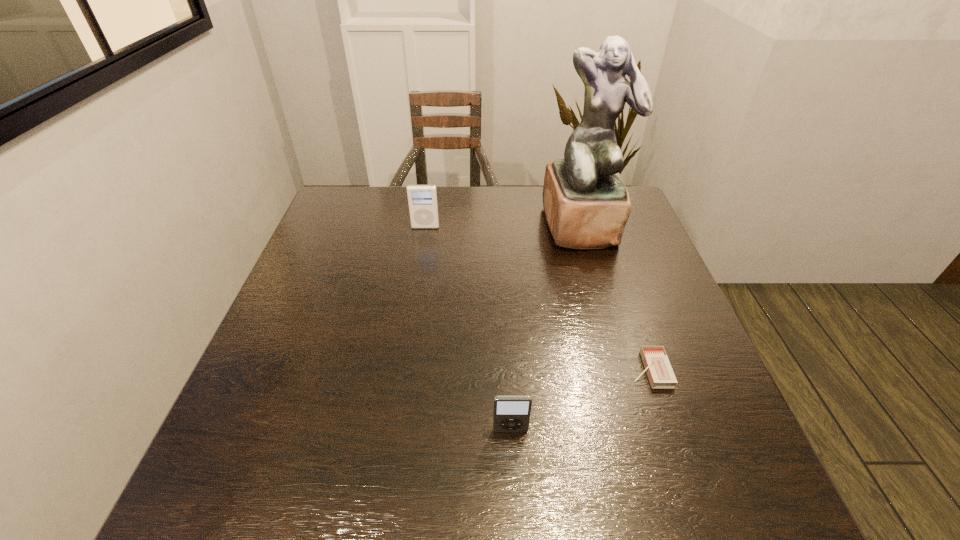
Identify the location of free space at the left edge. The image size is (960, 540). (345, 244).

Identify the location of vacant space at the right edge of the desktop. tap(631, 264).

Locate an element on the screen. free spot between the tallest object and the matchbox is located at coordinates (616, 298).

You are a GUI agent. You are given a task and a screenshot of the screen. Output one action in this format:
    pyautogui.click(x=<x>, y=<y>)
    Task: Click on the blank region between the shorter iPod and the shortest object
    The height and width of the screenshot is (540, 960).
    Given the screenshot: What is the action you would take?
    pyautogui.click(x=580, y=400)

Where is `free space between the leftmost object and the sculpture`? free space between the leftmost object and the sculpture is located at coordinates (504, 226).

The width and height of the screenshot is (960, 540). I want to click on free space between the shortest object and the third shortest object, so click(x=538, y=298).

Where is `unoccupied area between the second shortest object and the second nearest object`? unoccupied area between the second shortest object and the second nearest object is located at coordinates (580, 400).

Identify the location of unoccupied area between the leftmost object and the nearer iPod. (468, 329).

You are a GUI agent. You are given a task and a screenshot of the screen. Output one action in this format:
    pyautogui.click(x=<x>, y=<y>)
    Task: Click on the vacant area that lies between the nearer iPod and the left iPod
    
    Given the screenshot: What is the action you would take?
    [x=468, y=329]

The image size is (960, 540). Find the location of `free spot between the right iPod and the shortest object`. free spot between the right iPod and the shortest object is located at coordinates (580, 400).